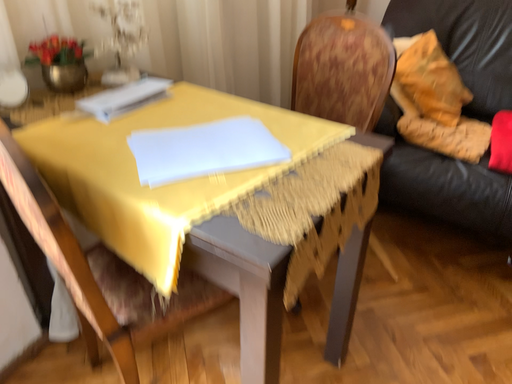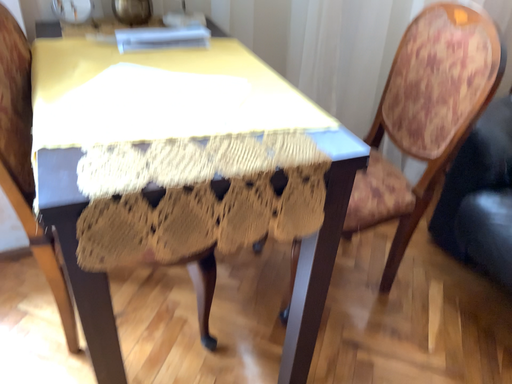
Question: How did the camera likely rotate when shooting the video?

Choices:
 (A) rotated left
 (B) rotated right

Answer: (A)